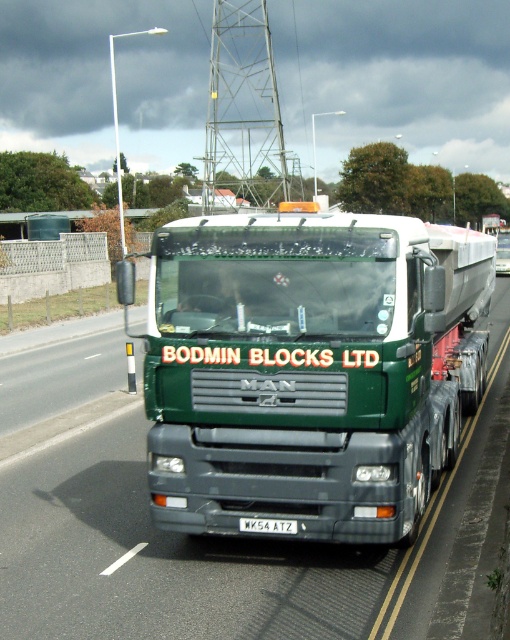
You are a traffic officer observing a green matte truck at center with a white metallic license plate at center. Which object is covering the other?

The green matte truck at center is positioned over the white metallic license plate at center, so it is covering it.

You are a traffic officer observing a green matte truck at center driving on a dual carriageway with a solid yellow edge line. The truck has a white metallic license plate at center. If the truck needs to make a U turn, will its width exceed the lane width considering the solid yellow line?

The green matte truck at center is wider than the white metallic license plate at center, but the license plate width is not indicative of the truck lane width. The solid yellow line indicates the edge of the lane, so the truck must stay within its lane and cannot cross it for a U turn.

You are a traffic officer observing a green matte truck at center with a white metallic license plate at center. Which object is bigger in size?

The green matte truck at center has a larger size compared to the white metallic license plate at center.